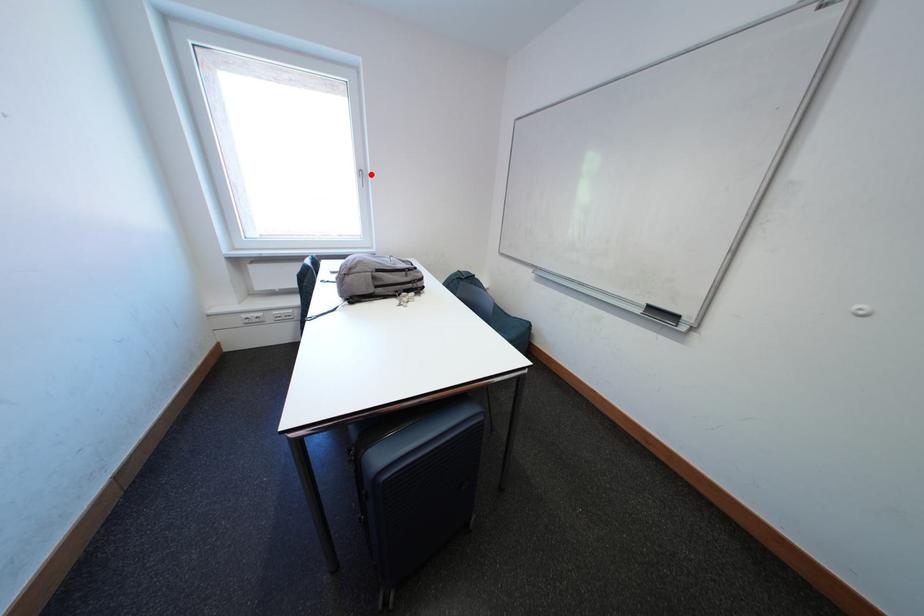
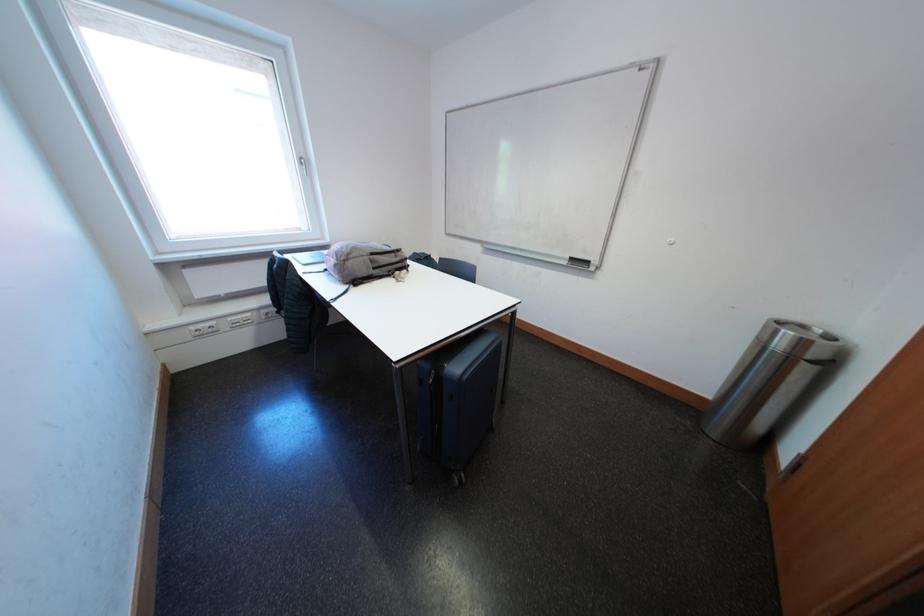
Where in the second image is the point corresponding to the highlighted location from the first image?

(311, 163)